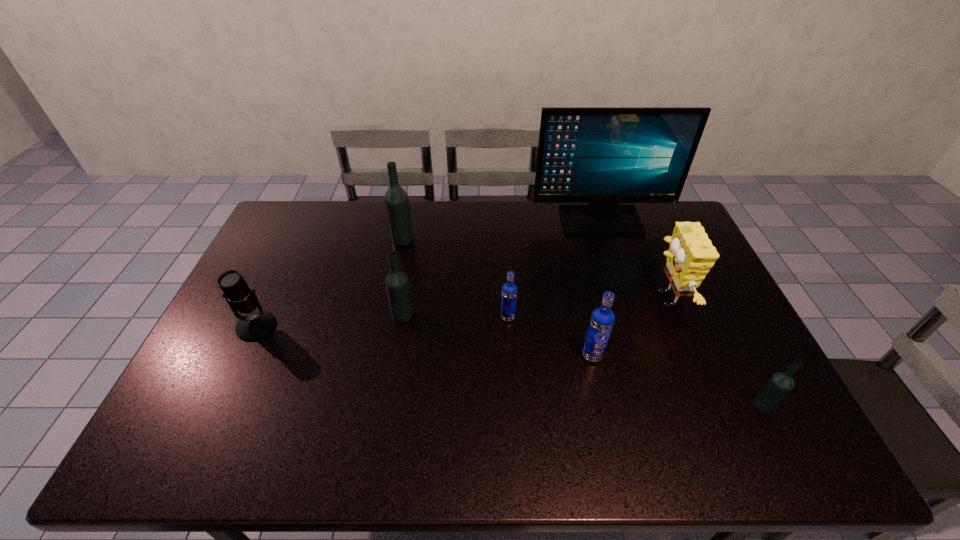
Where is `vacant space situated 0.260m on the right of the microphone`? vacant space situated 0.260m on the right of the microphone is located at coordinates (364, 326).

Identify the location of vacant space located on the left of the third vodka from left to right. The width and height of the screenshot is (960, 540). (423, 318).

Where is `vacant space positioned on the back of the rightmost vodka`? This screenshot has width=960, height=540. vacant space positioned on the back of the rightmost vodka is located at coordinates (715, 311).

Find the location of a particular element. This screenshot has width=960, height=540. monitor positioned at the far edge is located at coordinates (602, 156).

The height and width of the screenshot is (540, 960). In order to click on vodka that is at the far edge in this screenshot , I will do `click(396, 199)`.

Find the location of a particular element. object positioned at the left edge is located at coordinates (241, 298).

This screenshot has height=540, width=960. I want to click on monitor positioned at the right edge, so click(x=602, y=156).

Image resolution: width=960 pixels, height=540 pixels. I want to click on sponge located in the right edge section of the desktop, so coord(691,255).

At what (x,y) coordinates should I click in order to perform the action: click on vodka that is at the right edge. Please return your answer as a coordinate pair (x, y). Looking at the image, I should click on (780, 384).

This screenshot has width=960, height=540. I want to click on object that is positioned at the far right corner, so click(x=602, y=156).